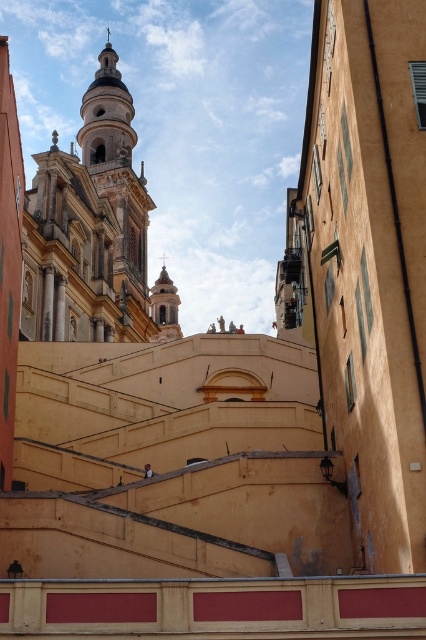
Who is shorter, white marble church at upper center or smooth white tower at center?

smooth white tower at center

Does white marble church at upper center appear over smooth white tower at center?

Correct, white marble church at upper center is located above smooth white tower at center.

Is point (45, 180) closer to camera compared to point (161, 292)?

Yes, point (45, 180) is closer to viewer.

The width and height of the screenshot is (426, 640). Identify the location of white marble church at upper center. (92, 230).